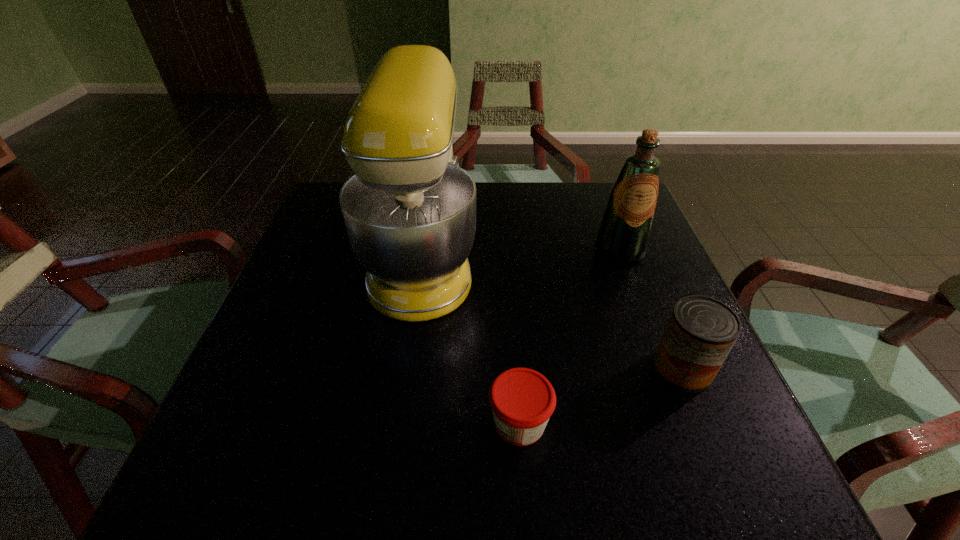
This screenshot has width=960, height=540. What are the coordinates of `free spot that satisfies the following two spatial constraints: 1. on the front-facing side of the third shortest object; 2. on the side of the mixer with the control knob` in the screenshot? It's located at (623, 259).

Where is `blank area in the image that satisfies the following two spatial constraints: 1. on the side of the second shortest object with the control knob; 2. on the left side of the mixer`? Image resolution: width=960 pixels, height=540 pixels. blank area in the image that satisfies the following two spatial constraints: 1. on the side of the second shortest object with the control knob; 2. on the left side of the mixer is located at coordinates (407, 368).

Identify the location of free location that satisfies the following two spatial constraints: 1. on the side of the tallest object with the control knob; 2. on the right side of the can. (407, 368).

The image size is (960, 540). In order to click on free spot that satisfies the following two spatial constraints: 1. on the front-facing side of the third shortest object; 2. on the side of the tallest object with the control knob in this screenshot , I will do `click(623, 259)`.

Locate an element on the screen. This screenshot has height=540, width=960. free space that satisfies the following two spatial constraints: 1. on the front-facing side of the can; 2. on the left side of the olive oil is located at coordinates (664, 368).

Where is `free spot that satisfies the following two spatial constraints: 1. on the front side of the can; 2. on the label side of the jam`? This screenshot has height=540, width=960. free spot that satisfies the following two spatial constraints: 1. on the front side of the can; 2. on the label side of the jam is located at coordinates point(705,422).